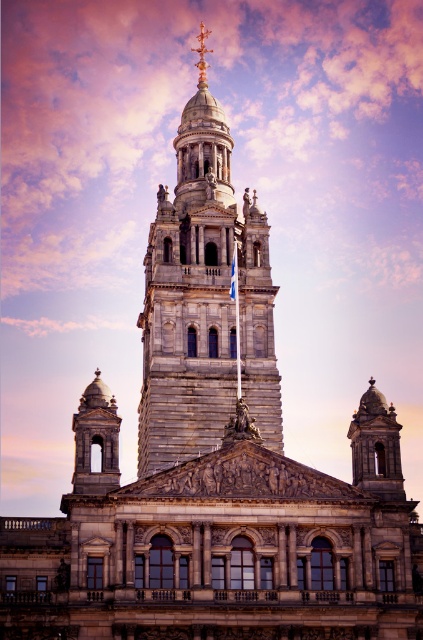
You are standing in front of the grand building and want to take a photo of both the stone tower at center and the smooth stone bell tower at left. Which tower should you focus on first to ensure both are in frame?

You should focus on the stone tower at center first because it is closer to you than the smooth stone bell tower at left, so adjusting the camera to include both would require accounting for their relative distances.

Looking at the grand building, where is the stone tower at center in relation to the smooth stone dome at upper center?

The stone tower at center is to the left of the smooth stone dome at upper center.